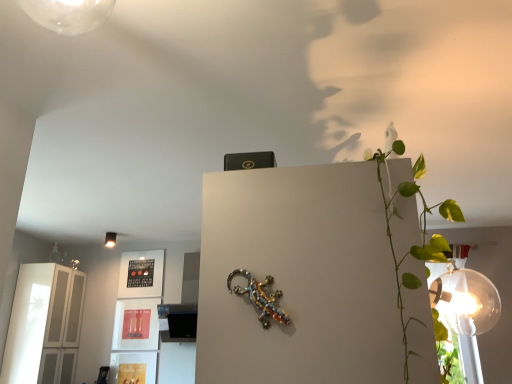
Question: From their relative heights in the image, would you say metallic beaded lizard at center is taller or shorter than white glossy cabinet at left?

Choices:
 (A) short
 (B) tall

Answer: (A)

Question: In terms of width, does metallic beaded lizard at center look wider or thinner when compared to white glossy cabinet at left?

Choices:
 (A) thin
 (B) wide

Answer: (A)

Question: Based on their relative distances, which object is farther from the metallic beaded lizard at center?

Choices:
 (A) white glossy cabinet at left
 (B) matte white lampshade at upper left

Answer: (B)

Question: Which is farther from the white glossy cabinet at left?

Choices:
 (A) metallic beaded lizard at center
 (B) matte white lampshade at upper left

Answer: (A)